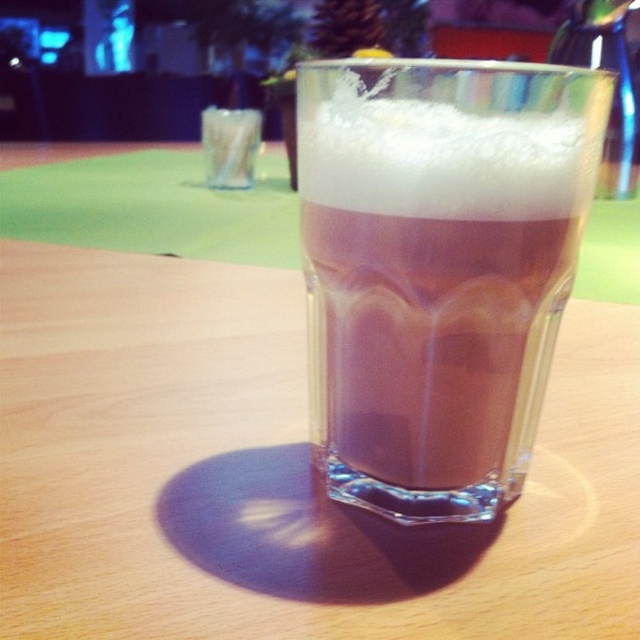
You are a bartender preparing a drink and notice the white fluffy foam at center and the green fuzzy pine cone at upper center in your glass. Which object takes up more space in the glass?

The green fuzzy pine cone at upper center occupies more space than the white fluffy foam at center in the glass.

From the picture: You are a bartender preparing a cocktail. You have a glass with a brown frothy beverage at center and a white fluffy foam at center. Which of these two has a greater volume?

The brown frothy beverage at center has a greater volume than the white fluffy foam at center because it is larger in size according to the description.

You are a bartender preparing a drink and need to place a cherry exactly at the center of the brown frothy beverage at center. According to the image, what are the coordinates where you should place the cherry?

The coordinates for the center of the brown frothy beverage at center are at point (438, 268), so you should place the cherry there.